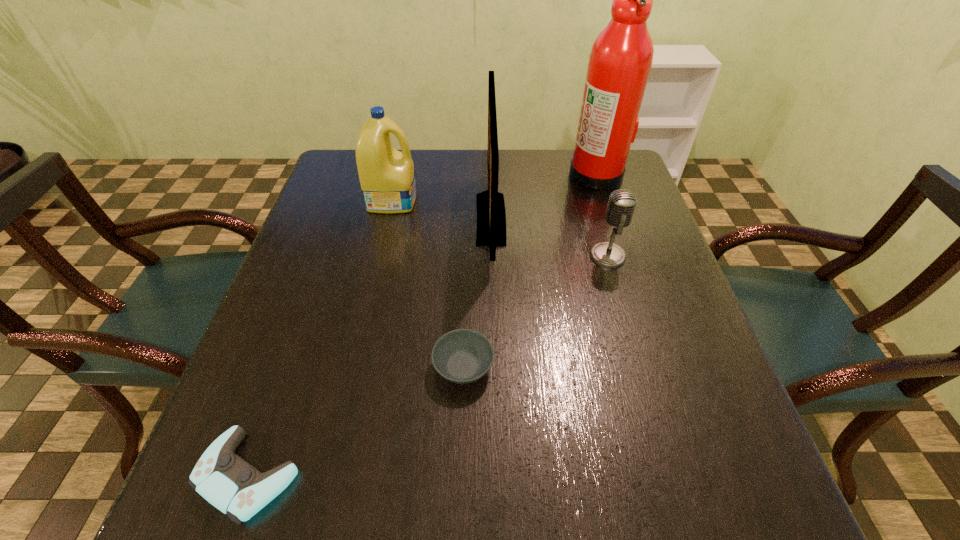
Image resolution: width=960 pixels, height=540 pixels. I want to click on the tallest object, so click(x=620, y=61).

The height and width of the screenshot is (540, 960). I want to click on monitor, so click(x=491, y=217).

Where is `the fourth shortest object`? The height and width of the screenshot is (540, 960). the fourth shortest object is located at coordinates (387, 178).

Where is `microphone`? microphone is located at coordinates (622, 202).

The image size is (960, 540). What are the coordinates of `soup bowl` in the screenshot? It's located at (462, 356).

Locate an element on the screen. This screenshot has width=960, height=540. control is located at coordinates (228, 482).

Find the location of a particular element. The width and height of the screenshot is (960, 540). free space located 0.210m on the label side of the fire extinguisher is located at coordinates (496, 174).

This screenshot has width=960, height=540. Find the location of `free space located on the label side of the fire extinguisher`. free space located on the label side of the fire extinguisher is located at coordinates click(x=430, y=174).

What are the coordinates of `blank area located 0.380m on the label side of the fire extinguisher` in the screenshot? It's located at (437, 174).

The height and width of the screenshot is (540, 960). Find the location of `blank space located on the front-facing side of the monitor`. blank space located on the front-facing side of the monitor is located at coordinates (425, 219).